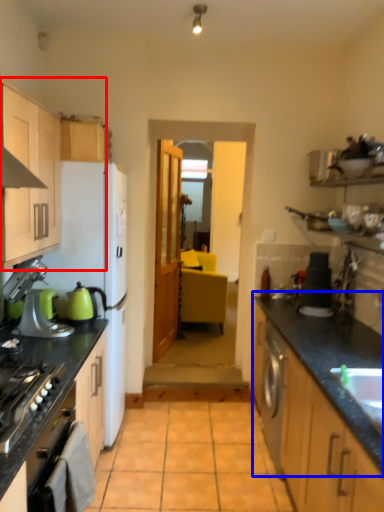
Question: Which point is closer to the camera, cabinetry (highlighted by a red box) or countertop (highlighted by a blue box)?

Choices:
 (A) cabinetry
 (B) countertop

Answer: (A)